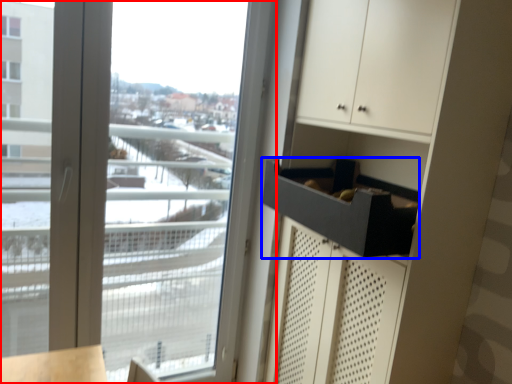
Question: Which object is closer to the camera taking this photo, window (highlighted by a red box) or drawer (highlighted by a blue box)?

Choices:
 (A) window
 (B) drawer

Answer: (B)